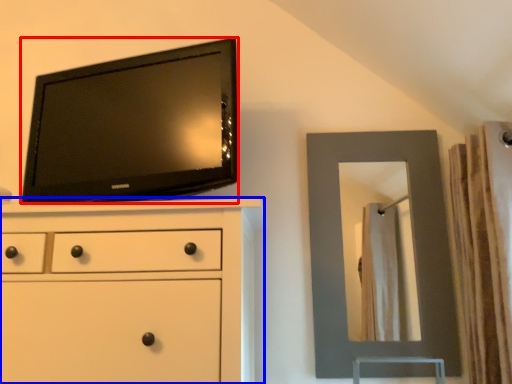
Question: Which of the following is the closest to the observer, television (highlighted by a red box) or chest of drawers (highlighted by a blue box)?

Choices:
 (A) television
 (B) chest of drawers

Answer: (B)